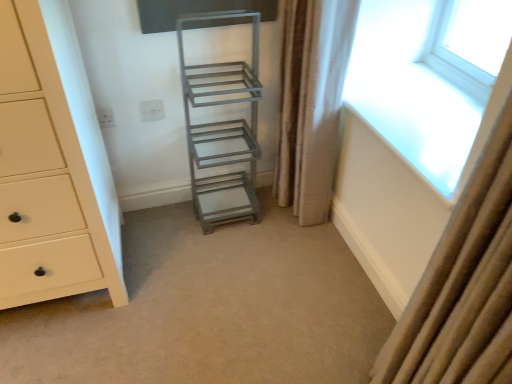
Question: From their relative heights in the image, would you say matte cream chest of drawers at left is taller or shorter than metallic gray shelf at center?

Choices:
 (A) tall
 (B) short

Answer: (A)

Question: In terms of size, does matte cream chest of drawers at left appear bigger or smaller than metallic gray shelf at center?

Choices:
 (A) small
 (B) big

Answer: (B)

Question: Estimate the real-world distances between objects in this image. Which object is closer to the metallic gray ladder at center?

Choices:
 (A) beige fabric curtain at right, which is counted as the second curtain, starting from the back
 (B) transparent glass window at upper right
 (C) beige textured curtain at right, marked as the first curtain in a left-to-right arrangement
 (D) metallic gray shelf at center
 (E) matte cream chest of drawers at left

Answer: (E)

Question: Which is nearer to the beige fabric curtain at right, the first curtain viewed from the right?

Choices:
 (A) matte cream chest of drawers at left
 (B) transparent glass window at upper right
 (C) beige textured curtain at right, the 1th curtain when ordered from back to front
 (D) metallic gray shelf at center
 (E) metallic gray ladder at center

Answer: (E)